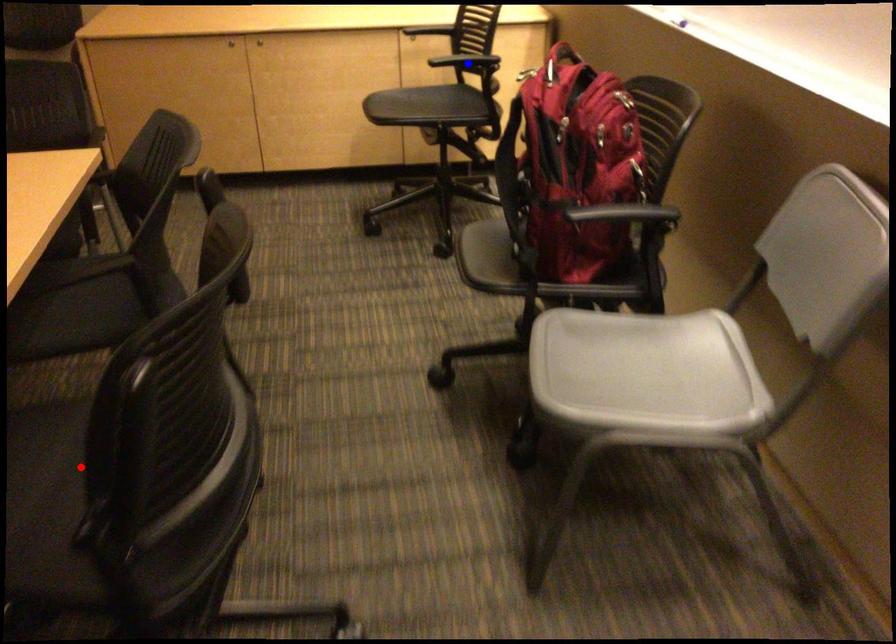
Question: Two points are marked on the image. Which point is closer to the camera?

Choices:
 (A) Blue point is closer.
 (B) Red point is closer.

Answer: (B)